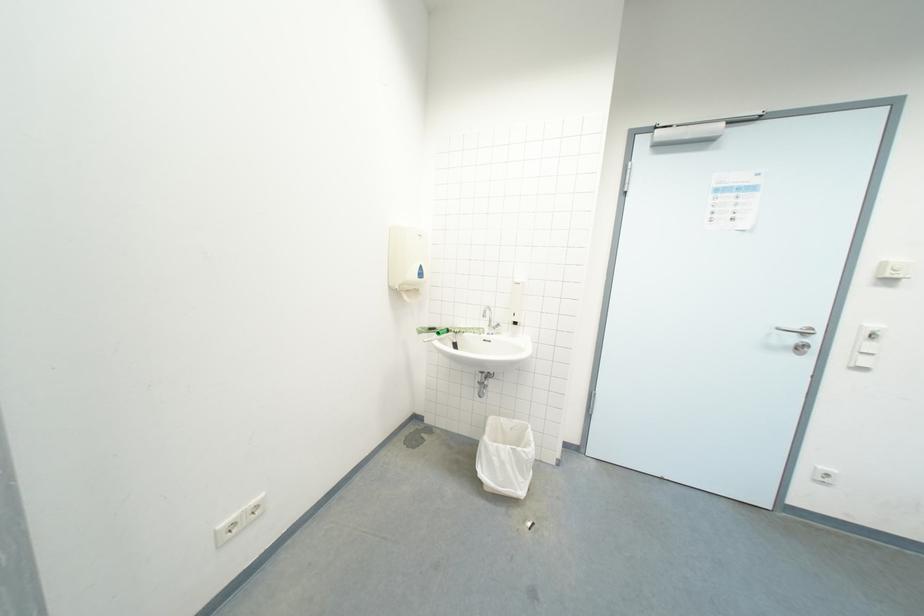
The location [529,525] corresponds to which object?

It corresponds to the small black object in the image.